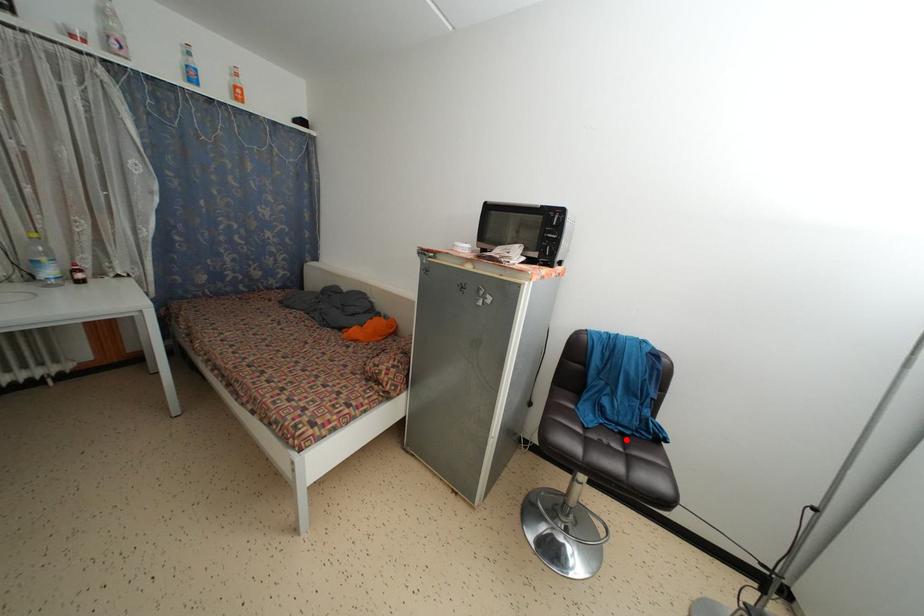
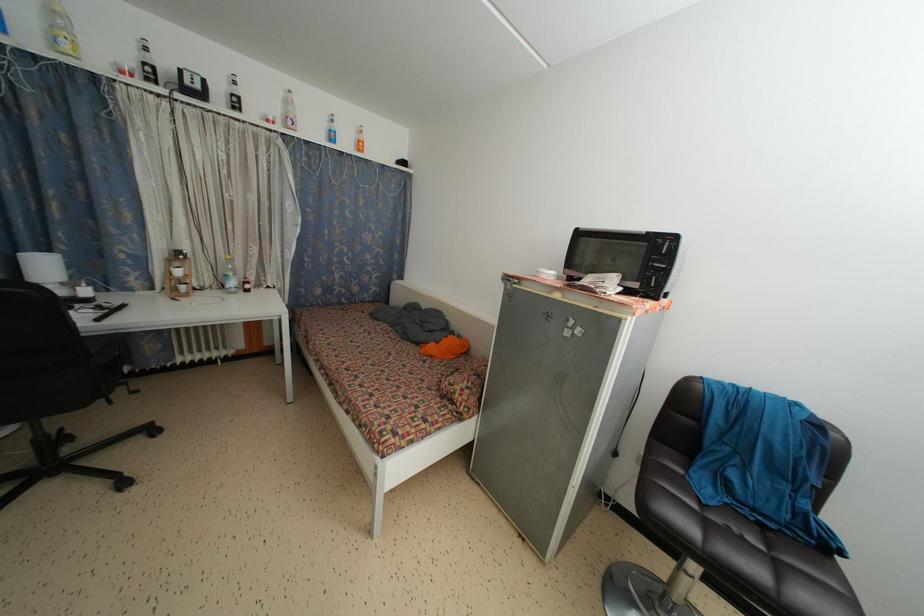
In the second image, find the point that corresponds to the highlighted location in the first image.

(767, 532)